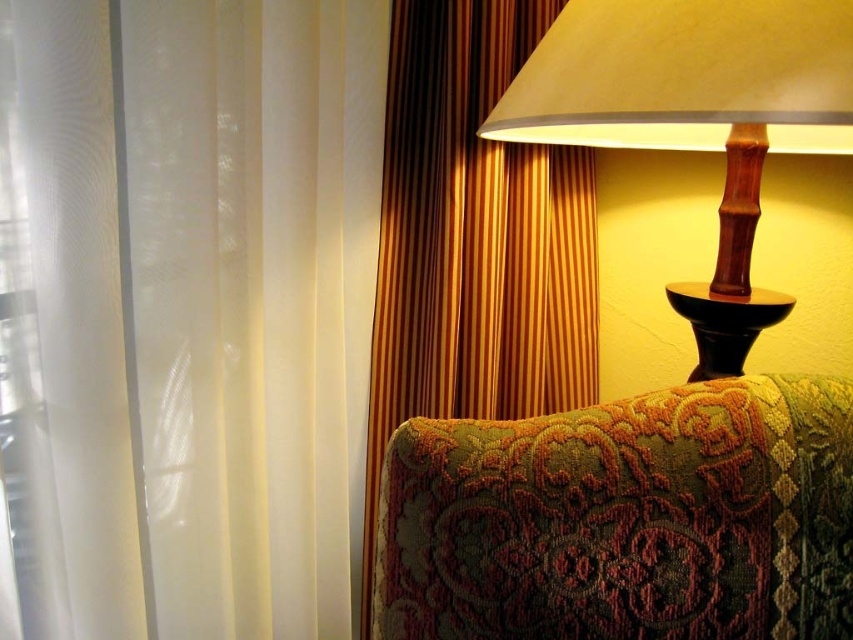
Is point (796, 74) less distant than point (706, 321)?

Yes, point (796, 74) is closer to viewer.

Can you confirm if wooden table lamp at upper right is positioned to the right of black wood side table at right?

No, wooden table lamp at upper right is not to the right of black wood side table at right.

Describe the element at coordinates (692, 97) in the screenshot. This screenshot has width=853, height=640. I see `wooden table lamp at upper right` at that location.

Find the location of a particular element. The height and width of the screenshot is (640, 853). wooden table lamp at upper right is located at coordinates (692, 97).

Is velvet-like green couch at right smaller than gold striped curtain at upper right?

Yes, velvet-like green couch at right is smaller than gold striped curtain at upper right.

Is velvet-like green couch at right bigger than gold striped curtain at upper right?

No, velvet-like green couch at right is not bigger than gold striped curtain at upper right.

Between point (779, 580) and point (465, 333), which one is positioned in front?

Point (779, 580)

The height and width of the screenshot is (640, 853). What are the coordinates of `velvet-like green couch at right` in the screenshot? It's located at (625, 518).

Can you confirm if white sheer curtain at left is smaller than velvet-like green couch at right?

Actually, white sheer curtain at left might be larger than velvet-like green couch at right.

Does white sheer curtain at left have a greater height compared to velvet-like green couch at right?

Yes, white sheer curtain at left is taller than velvet-like green couch at right.

Is point (186, 365) less distant than point (782, 493)?

No, it is behind (782, 493).

Identify the location of white sheer curtain at left. (189, 310).